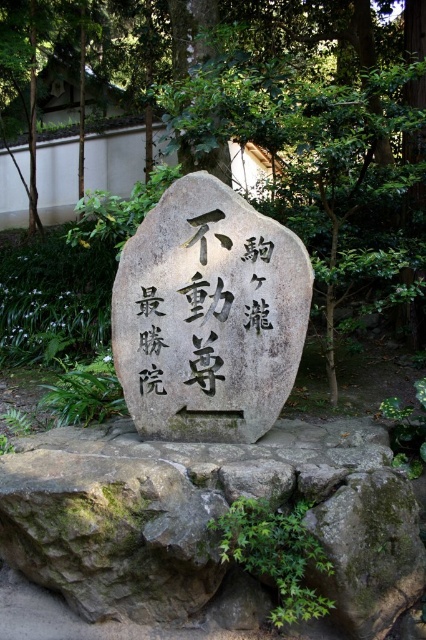
How far apart are gray stone boulder at center and black stone writing at center?

gray stone boulder at center and black stone writing at center are 1.64 inches apart.

What do you see at coordinates (209, 316) in the screenshot? The image size is (426, 640). I see `gray stone boulder at center` at bounding box center [209, 316].

Who is more distant from viewer, (x=209, y=410) or (x=255, y=256)?

The point (x=209, y=410) is more distant.

The image size is (426, 640). Identify the location of gray stone boulder at center. (x=209, y=316).

Who is taller, green leafy tree at center or black stone writing at center?

Standing taller between the two is green leafy tree at center.

Looking at this image, is green leafy tree at center to the right of black stone writing at center from the viewer's perspective?

Indeed, green leafy tree at center is positioned on the right side of black stone writing at center.

Who is more forward, (391,216) or (164,305)?

Point (164,305)

Find the location of `green leafy tree at center`. green leafy tree at center is located at coordinates (319, 152).

Is gray rough stone at center above gray stone boulder at center?

No.

Looking at this image, who is positioned more to the right, gray rough stone at center or gray stone boulder at center?

gray stone boulder at center

Describe the element at coordinates (206, 524) in the screenshot. This screenshot has width=426, height=640. I see `gray rough stone at center` at that location.

This screenshot has width=426, height=640. I want to click on gray rough stone at center, so click(x=206, y=524).